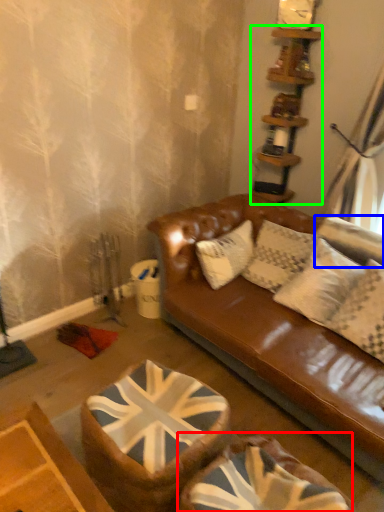
Question: Considering the real-world distances, which object is closest to swivel chair (highlighted by a red box)? pillow (highlighted by a blue box) or shelf (highlighted by a green box).

Choices:
 (A) pillow
 (B) shelf

Answer: (A)